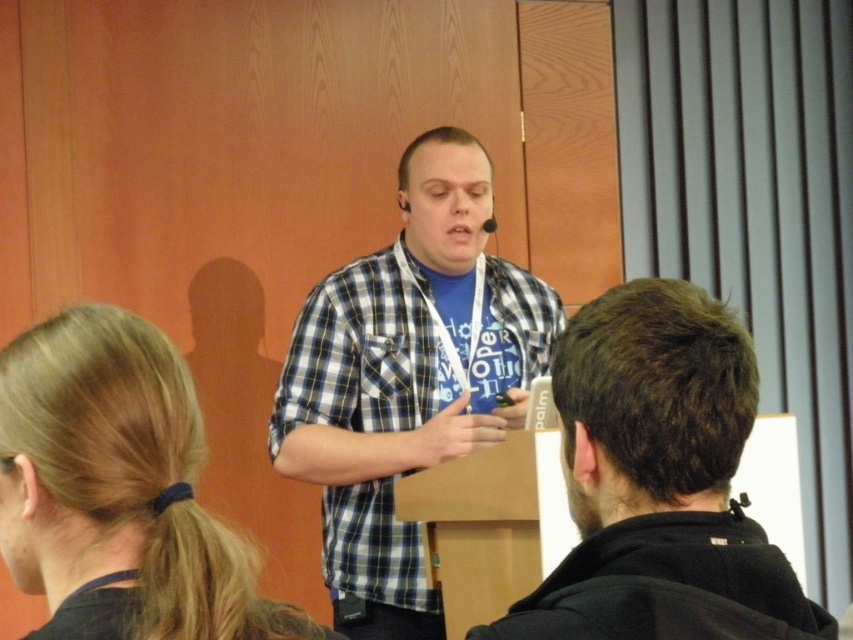
What is the point at coordinates (407,380) located on in the scene?

The point at coordinates (407,380) is located on the checkered fabric shirt at center.

Consider the image. You are an event organizer who needs to arrange seating for the speakers. The checkered fabric shirt at center and the black cotton shirt at center are both present. Which shirt is taller?

The checkered fabric shirt at center is taller than the black cotton shirt at center according to the description.